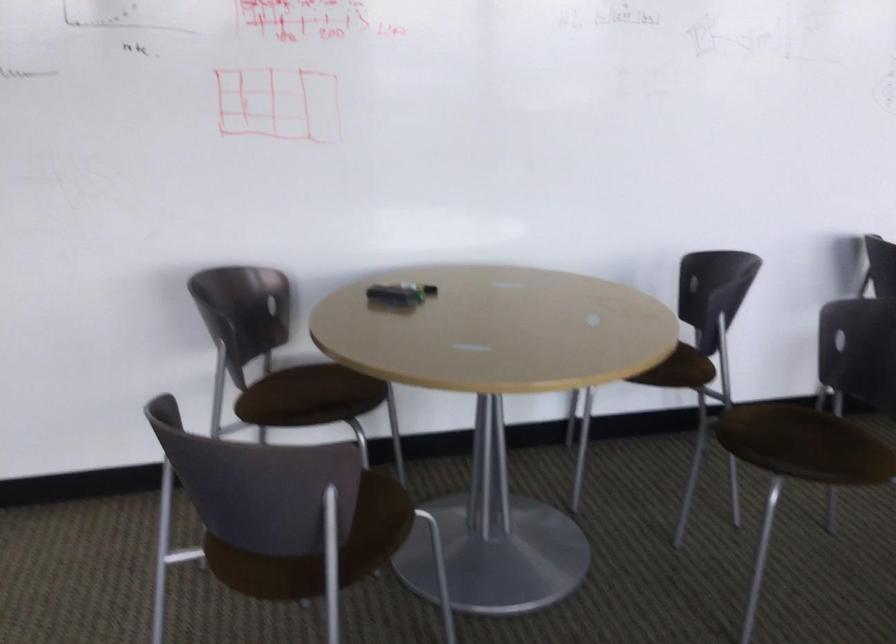
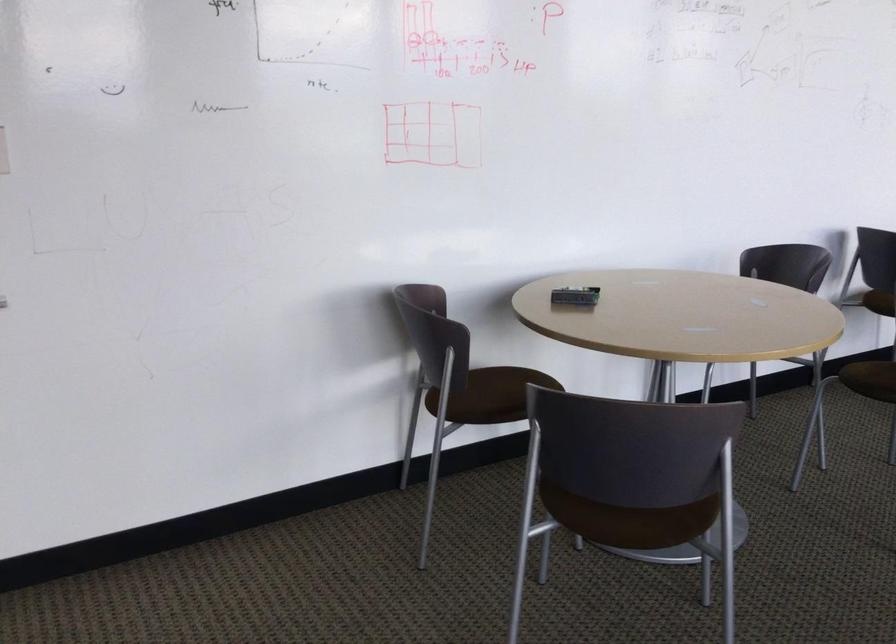
Locate, in the second image, the point that corresponds to [722,424] in the first image.

(872, 379)